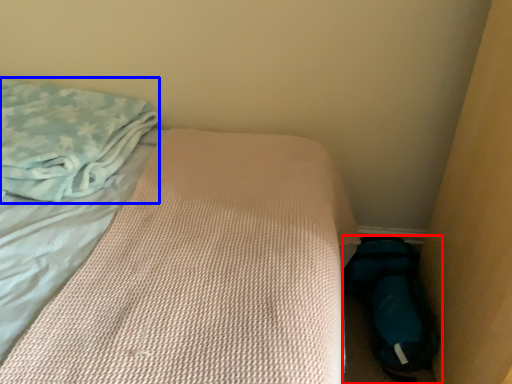
Question: Which of the following is the farthest to the observer, footwear (highlighted by a red box) or cloth (highlighted by a blue box)?

Choices:
 (A) footwear
 (B) cloth

Answer: (A)